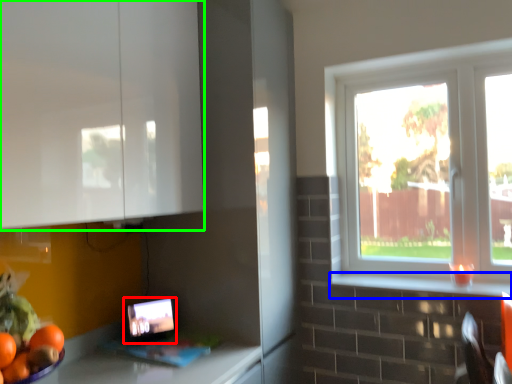
Question: Which object is positioned closest to tablet computer (highlighted by a red box)? Select from window sill (highlighted by a blue box) and cabinetry (highlighted by a green box).

Choices:
 (A) window sill
 (B) cabinetry

Answer: (B)